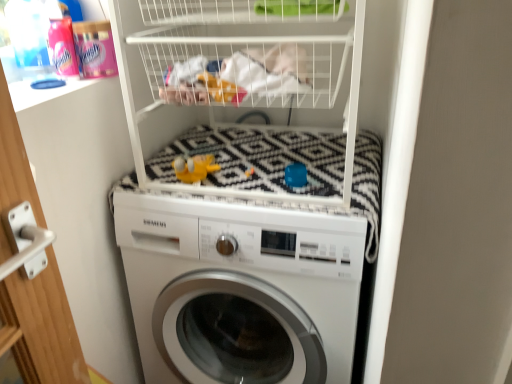
Question: Is white glossy washing machine at center inside the boundaries of yellow rubber duck at center, or outside?

Choices:
 (A) outside
 (B) inside

Answer: (A)

Question: Relative to yellow rubber duck at center, is white glossy washing machine at center in front or behind?

Choices:
 (A) front
 (B) behind

Answer: (A)

Question: Is white glossy washing machine at center taller or shorter than yellow rubber duck at center?

Choices:
 (A) short
 (B) tall

Answer: (B)

Question: Is yellow rubber duck at center situated inside white glossy washing machine at center or outside?

Choices:
 (A) outside
 (B) inside

Answer: (A)

Question: Is yellow rubber duck at center bigger or smaller than white glossy washing machine at center?

Choices:
 (A) big
 (B) small

Answer: (B)

Question: From a real-world perspective, is yellow rubber duck at center above or below white glossy washing machine at center?

Choices:
 (A) above
 (B) below

Answer: (A)

Question: From the image's perspective, relative to white glossy washing machine at center, is yellow rubber duck at center above or below?

Choices:
 (A) above
 (B) below

Answer: (A)